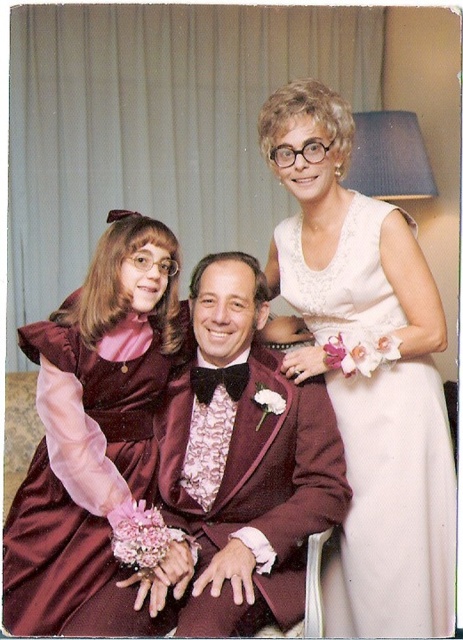
You are at a formal event and see two dresses in the image. The white satin dress at upper right and the velvet burgundy dress at left. Which dress is positioned to the right side of the other?

The white satin dress at upper right is positioned to the right of the velvet burgundy dress at left.

You are standing in the living room and need to find the white satin dress at upper right. According to the coordinates provided, where should you look relative to the lamp with a dark shade in the background?

The white satin dress at upper right is located at point (x=363, y=376), which means it is positioned to the right and slightly above the lamp with a dark shade in the background.

You are standing in the living room and want to hand a bouquet to both the white satin dress at upper right and the velvet burgundy dress at left. Which person should you approach first to ensure you can reach them without moving closer?

You should approach the white satin dress at upper right first because it is closer to you than the velvet burgundy dress at left, so you can reach them without needing to move closer.